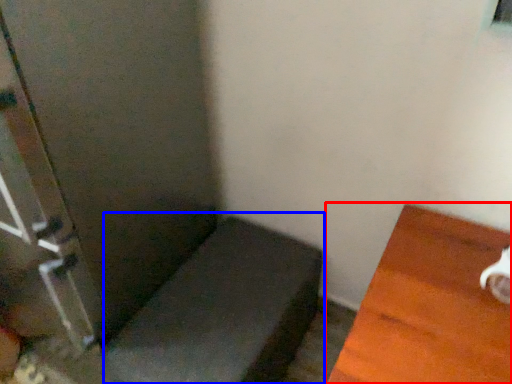
Question: Which of the following is the farthest to the observer, furniture (highlighted by a red box) or furniture (highlighted by a blue box)?

Choices:
 (A) furniture
 (B) furniture

Answer: (B)